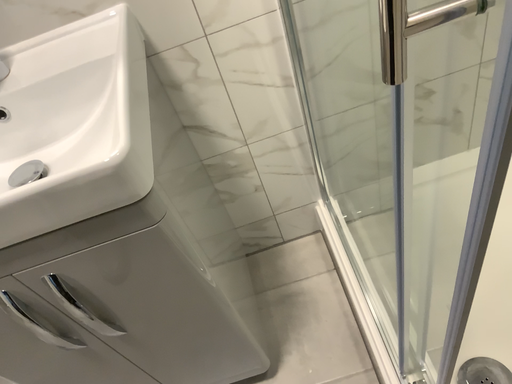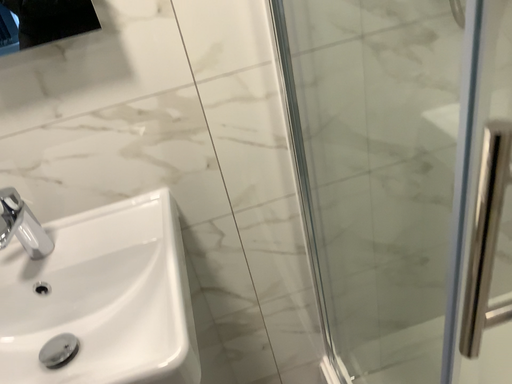
Question: Which way did the camera rotate in the video?

Choices:
 (A) rotated upward
 (B) rotated downward

Answer: (A)